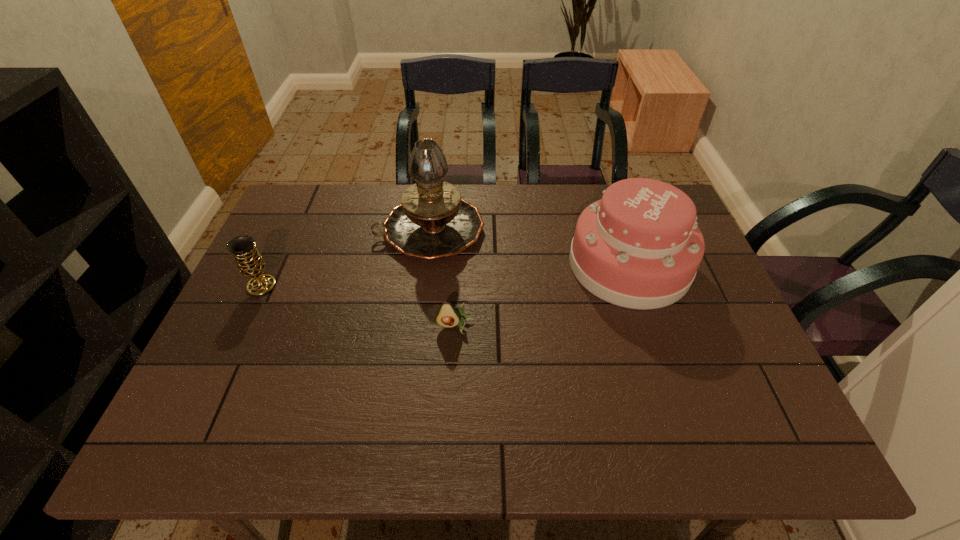
You are a GUI agent. You are given a task and a screenshot of the screen. Output one action in this format:
    pyautogui.click(x=<x>, y=<y>)
    Task: Click on the free space at the near right corner of the desktop
    Image resolution: width=960 pixels, height=540 pixels.
    Given the screenshot: What is the action you would take?
    pyautogui.click(x=718, y=443)

Identify the location of vacant area that lies between the oil lamp and the leftmost object. (346, 258).

Where is `free area in between the oil lamp and the chalice`? The width and height of the screenshot is (960, 540). free area in between the oil lamp and the chalice is located at coordinates (346, 258).

At what (x,y) coordinates should I click in order to perform the action: click on free point between the shortest object and the second shortest object. Please return your answer as a coordinate pair (x, y). Image resolution: width=960 pixels, height=540 pixels. Looking at the image, I should click on (359, 306).

Image resolution: width=960 pixels, height=540 pixels. I want to click on empty space that is in between the leftmost object and the nearest object, so click(359, 306).

I want to click on vacant area between the oil lamp and the avocado, so click(x=443, y=279).

Locate an element on the screen. This screenshot has height=540, width=960. free area in between the shortest object and the third shortest object is located at coordinates (542, 295).

At what (x,y) coordinates should I click in order to perform the action: click on vacant area that lies between the rightmost object and the tallest object. Please return your answer as a coordinate pair (x, y). Looking at the image, I should click on (529, 247).

At what (x,y) coordinates should I click in order to perform the action: click on free space that is in between the shortest object and the second shortest object. Please return your answer as a coordinate pair (x, y). This screenshot has height=540, width=960. Looking at the image, I should click on (359, 306).

Where is `vacant region between the tallest object and the avocado`? This screenshot has width=960, height=540. vacant region between the tallest object and the avocado is located at coordinates (443, 279).